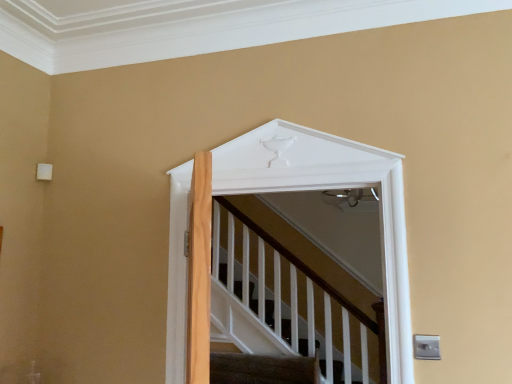
Question: From the image's perspective, is white matte door at upper center above or below carpeted stairs at lower center?

Choices:
 (A) above
 (B) below

Answer: (A)

Question: Would you say white matte door at upper center is to the left or to the right of carpeted stairs at lower center in the picture?

Choices:
 (A) left
 (B) right

Answer: (B)

Question: From a real-world perspective, relative to carpeted stairs at lower center, is white matte door at upper center vertically above or below?

Choices:
 (A) below
 (B) above

Answer: (B)

Question: Is carpeted stairs at lower center spatially inside white matte door at upper center, or outside of it?

Choices:
 (A) outside
 (B) inside

Answer: (A)

Question: Is carpeted stairs at lower center wider or thinner than white matte door at upper center?

Choices:
 (A) thin
 (B) wide

Answer: (B)

Question: Is carpeted stairs at lower center bigger or smaller than white matte door at upper center?

Choices:
 (A) small
 (B) big

Answer: (A)

Question: Is point (209, 365) closer or farther from the camera than point (385, 278)?

Choices:
 (A) closer
 (B) farther

Answer: (B)